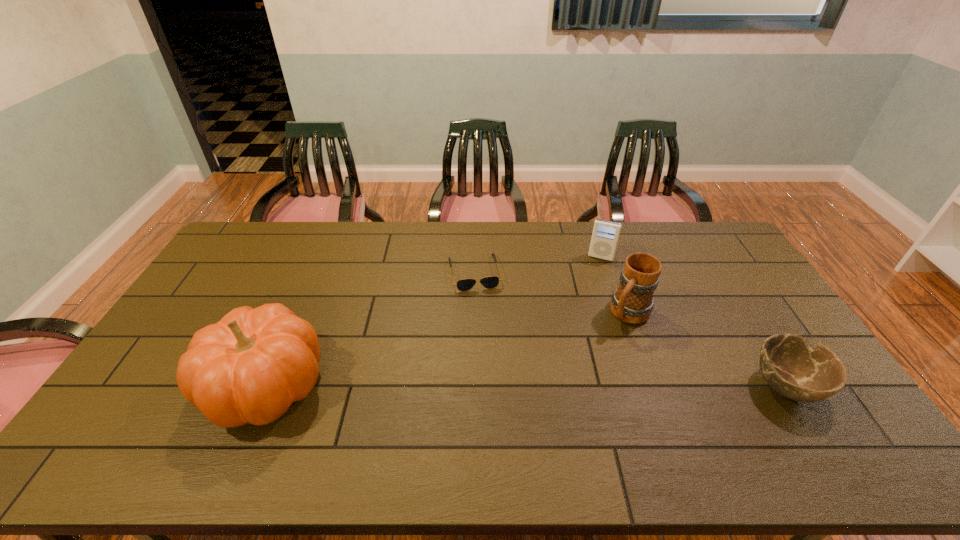
The image size is (960, 540). In order to click on blank space located on the back of the bowl in this screenshot , I will do `click(756, 334)`.

At what (x,y) coordinates should I click in order to perform the action: click on blank space located on the front-facing side of the second object from left to right. Please return your answer as a coordinate pair (x, y). Looking at the image, I should click on (497, 376).

Find the location of `free space located 0.400m on the front-facing side of the second object from left to right`. free space located 0.400m on the front-facing side of the second object from left to right is located at coordinates (500, 391).

You are a GUI agent. You are given a task and a screenshot of the screen. Output one action in this format:
    pyautogui.click(x=<x>, y=<y>)
    Task: Click on the vacant space located on the front-facing side of the second object from left to right
    The height and width of the screenshot is (540, 960).
    Given the screenshot: What is the action you would take?
    pyautogui.click(x=485, y=319)

At what (x,y) coordinates should I click in order to perform the action: click on vacant space located 0.090m on the front-facing side of the third tallest object. Please return your answer as a coordinate pair (x, y). Looking at the image, I should click on (593, 276).

The height and width of the screenshot is (540, 960). In order to click on free spot located 0.160m on the front-facing side of the third tallest object in this screenshot , I will do `click(589, 289)`.

I want to click on free space located on the front-facing side of the third tallest object, so click(x=589, y=287).

Locate an element on the screen. The height and width of the screenshot is (540, 960). vacant space located 0.280m on the side of the mug with the handle is located at coordinates (572, 386).

Find the location of a particular element. This screenshot has height=540, width=960. vacant space situated 0.330m on the side of the mug with the handle is located at coordinates (563, 399).

Identify the location of free point located 0.260m on the side of the mug with the handle. The image size is (960, 540). (576, 381).